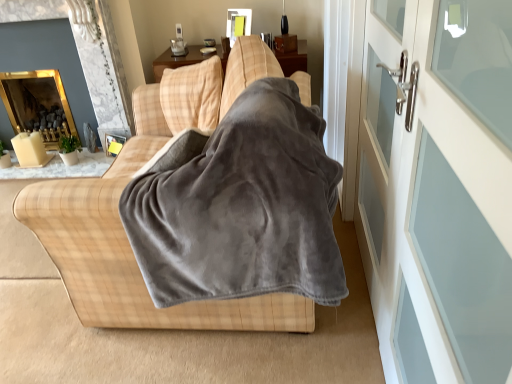
Question: From a real-world perspective, is gold reflective fireplace at upper left, positioned as the first fireplace in front-to-back order, above or below plaid fabric couch at center?

Choices:
 (A) below
 (B) above

Answer: (B)

Question: Considering the positions of gold reflective fireplace at upper left, the 2th fireplace from the back, and plaid fabric couch at center in the image, is gold reflective fireplace at upper left, the 2th fireplace from the back, wider or thinner than plaid fabric couch at center?

Choices:
 (A) wide
 (B) thin

Answer: (B)

Question: Which object is the closest to the plaid fabric couch at center?

Choices:
 (A) white glass door at right, the 2th screen door in the back-to-front sequence
 (B) gray fleece blanket at center
 (C) white glass screen door at right, the second screen door when ordered from front to back
 (D) metallic gold picture frame at upper left
 (E) gold reflective mirror at upper left, placed as the second fireplace when sorted from front to back

Answer: (B)

Question: Which is farther from the plaid fabric couch at center?

Choices:
 (A) white glass door at right, the 2th screen door in the back-to-front sequence
 (B) gold reflective mirror at upper left, placed as the second fireplace when sorted from front to back
 (C) gray fleece blanket at center
 (D) white glass screen door at right, positioned as the 1th screen door in back-to-front order
 (E) metallic gold picture frame at upper left

Answer: (B)